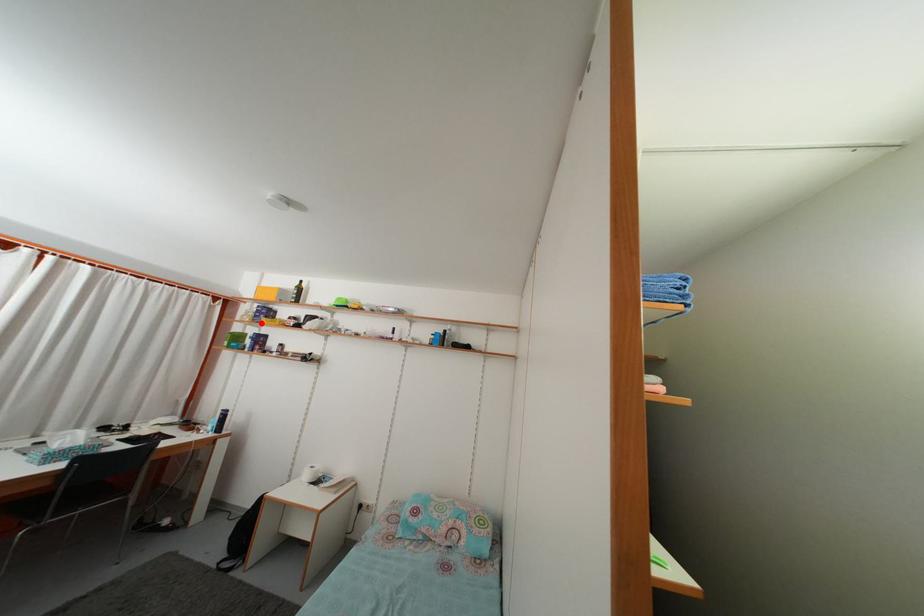
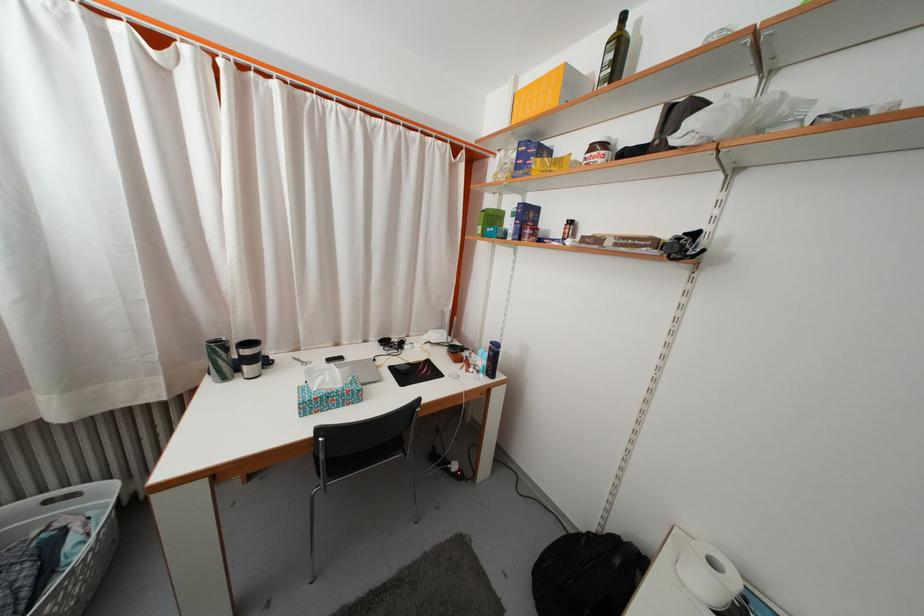
In the second image, find the point that corresponds to the highlighted location in the first image.

(523, 175)